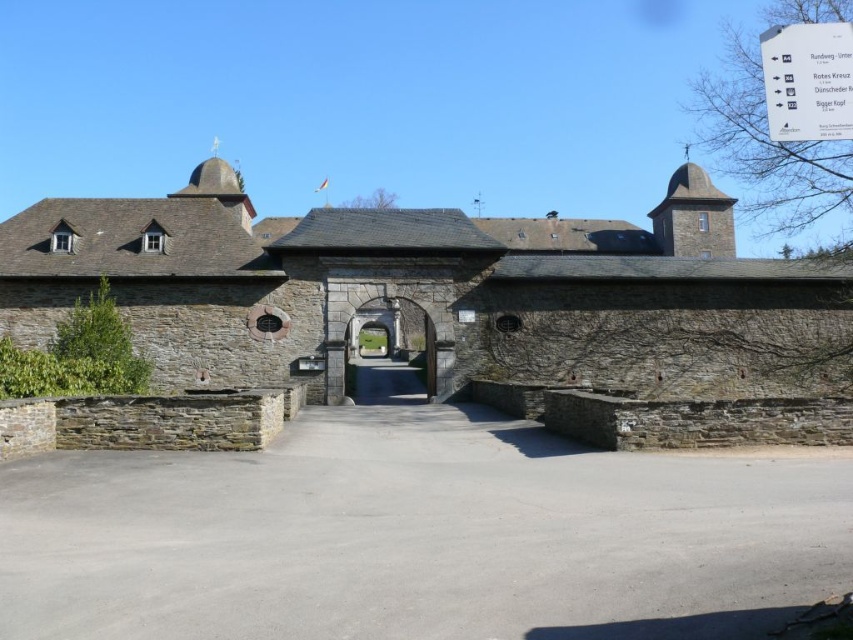
You are a visitor arriving at the castle and want to enter through the main gate. You see the gray concrete driveway at center and the stone archway at center. Which object should you walk towards to reach the entrance?

You should walk towards the stone archway at center because it is the entrance, and the gray concrete driveway at center is located below it, leading towards the archway.